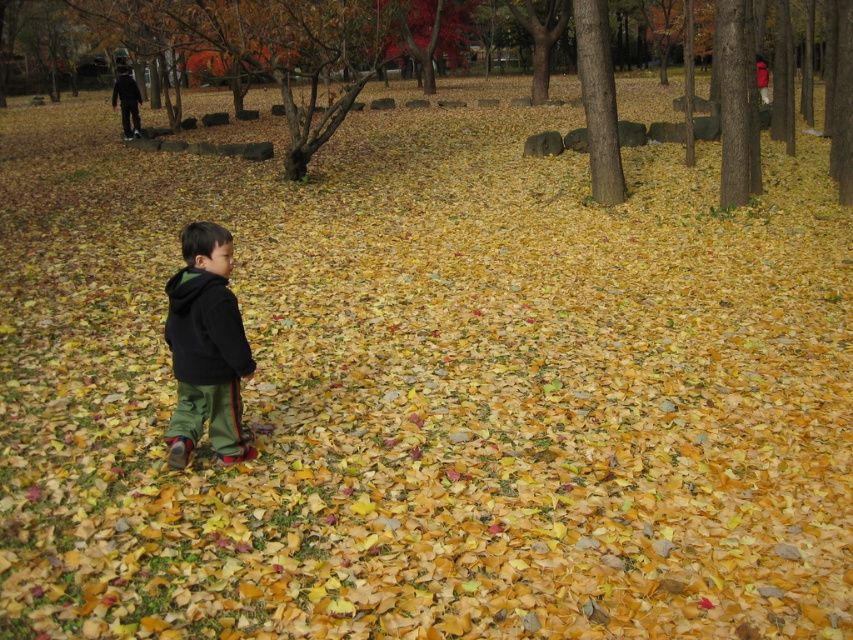
Between point (347, 134) and point (604, 13), which one is positioned behind?

Positioned behind is point (347, 134).

I want to click on brown bark tree at center, so click(x=413, y=180).

In the scene shown: Who is shorter, black fleece jacket at center or brown rough bark tree at center?

Standing shorter between the two is black fleece jacket at center.

The width and height of the screenshot is (853, 640). In order to click on black fleece jacket at center in this screenshot , I will do (206, 348).

I want to click on black fleece jacket at center, so click(x=206, y=348).

Between point (114, 180) and point (196, 355), which one is positioned behind?

Point (114, 180)

Is brown bark tree at center closer to the viewer compared to black fleece jacket at center?

That is True.

Where is `brown bark tree at center`? This screenshot has height=640, width=853. brown bark tree at center is located at coordinates (413, 180).